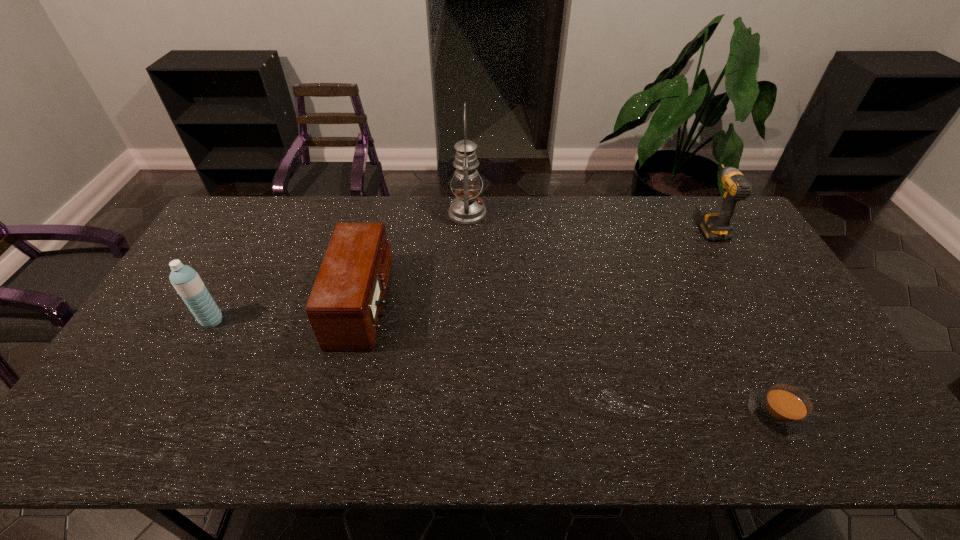
Locate an element on the screen. The width and height of the screenshot is (960, 540). the third object from right to left is located at coordinates (467, 208).

You are a GUI agent. You are given a task and a screenshot of the screen. Output one action in this format:
    pyautogui.click(x=<x>, y=<y>)
    Task: Click on the tallest object
    
    Given the screenshot: What is the action you would take?
    (467, 208)

The height and width of the screenshot is (540, 960). I want to click on drill, so click(x=715, y=226).

Locate an element on the screen. water bottle is located at coordinates (186, 281).

Locate an element on the screen. The image size is (960, 540). radio receiver is located at coordinates (345, 307).

You are a GUI agent. You are given a task and a screenshot of the screen. Output one action in this format:
    pyautogui.click(x=<x>, y=<y>)
    Task: Click on the fourth object from right to left
    
    Given the screenshot: What is the action you would take?
    pyautogui.click(x=345, y=307)

I want to click on the nearest object, so click(x=782, y=410).

Find the location of a particular element. the shortest object is located at coordinates (782, 410).

Identify the location of vacant area situated on the right of the oil lamp. This screenshot has height=540, width=960. (561, 213).

Locate an element on the screen. free space located 0.060m with the drill bit of the drill facing forward is located at coordinates (695, 201).